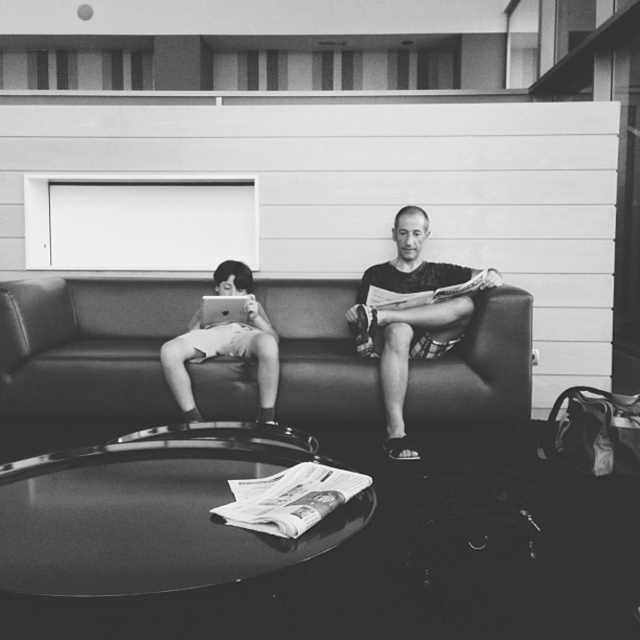
Can you confirm if smooth beige shorts at left is wider than matte black laptop at left?

Yes, smooth beige shorts at left is wider than matte black laptop at left.

Can you confirm if smooth beige shorts at left is bigger than matte black laptop at left?

Yes, smooth beige shorts at left is bigger than matte black laptop at left.

This screenshot has height=640, width=640. What do you see at coordinates (225, 344) in the screenshot?
I see `smooth beige shorts at left` at bounding box center [225, 344].

Find the location of `smooth beige shorts at left`. smooth beige shorts at left is located at coordinates (225, 344).

Does smooth black shorts at center lie in front of matte black laptop at left?

Yes.

Does smooth black shorts at center appear on the left side of matte black laptop at left?

No, smooth black shorts at center is not to the left of matte black laptop at left.

Between point (369, 275) and point (211, 317), which one is positioned behind?

Point (369, 275)

You are a GUI agent. You are given a task and a screenshot of the screen. Output one action in this format:
    pyautogui.click(x=<x>, y=<y>)
    Task: Click on the smooth black shorts at center
    
    Given the screenshot: What is the action you would take?
    pyautogui.click(x=410, y=316)

Measure the distance between leather couch at center and camera.

leather couch at center and camera are 3.25 meters apart from each other.

Between point (1, 404) and point (241, 314), which one is positioned in front?

Positioned in front is point (1, 404).

The width and height of the screenshot is (640, 640). I want to click on leather couch at center, so click(88, 348).